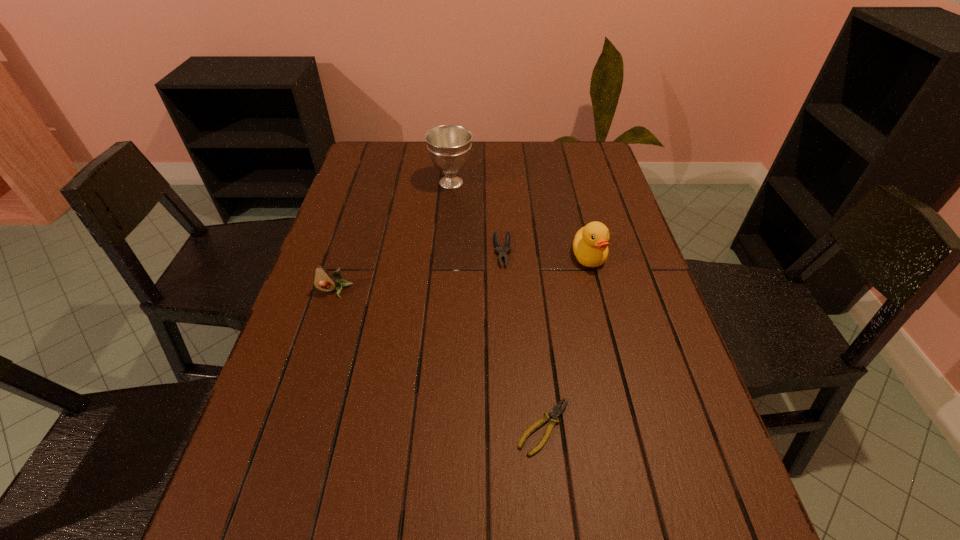
This screenshot has height=540, width=960. I want to click on free spot located on the front of the farthest object, so coord(449,207).

Find the location of a particular element. vacant space located at the beak of the second tallest object is located at coordinates (608, 331).

You are a GUI agent. You are given a task and a screenshot of the screen. Output one action in this format:
    pyautogui.click(x=<x>, y=<y>)
    Task: Click on the free space located 0.060m on the seed side of the fourth farthest object
    Image resolution: width=960 pixels, height=540 pixels.
    Given the screenshot: What is the action you would take?
    pyautogui.click(x=326, y=317)

You are a GUI agent. You are given a task and a screenshot of the screen. Output one action in this format:
    pyautogui.click(x=<x>, y=<y>)
    Task: Click on the vacant space located at the gripping part of the fourth tallest object
    
    Given the screenshot: What is the action you would take?
    pyautogui.click(x=508, y=358)

Locate an element on the screen. The image size is (960, 540). free space located on the left of the nearer pliers is located at coordinates (475, 427).

At what (x,y) coordinates should I click in order to perform the action: click on object located at the far edge. Please return your answer as a coordinate pair (x, y). Looking at the image, I should click on (449, 146).

Find the location of a particular element. The image size is (960, 540). object positioned at the left edge is located at coordinates (323, 280).

I want to click on object at the right edge, so click(x=590, y=247).

Image resolution: width=960 pixels, height=540 pixels. What are the coordinates of `free point at the left edge` in the screenshot? It's located at (277, 372).

Identify the location of blank area at the right edge. Image resolution: width=960 pixels, height=540 pixels. (638, 276).